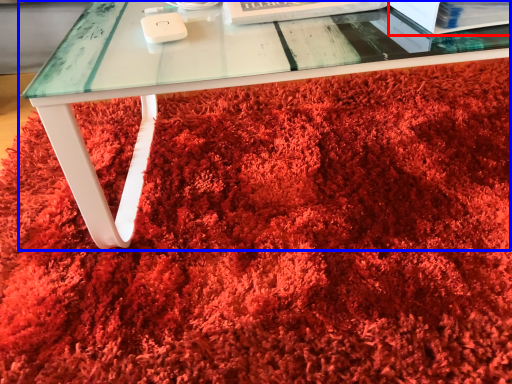
Question: Which object is closer to the camera taking this photo, paperback book (highlighted by a red box) or table (highlighted by a blue box)?

Choices:
 (A) paperback book
 (B) table

Answer: (B)